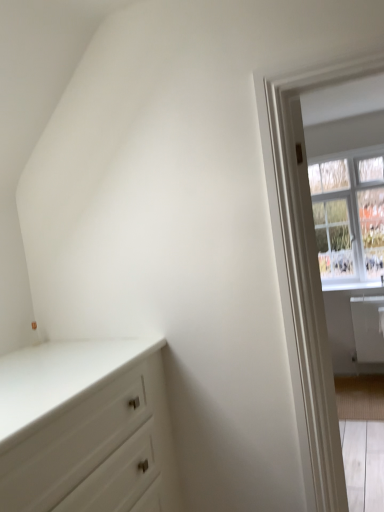
Question: Does white wooden door at right appear on the right side of white glossy chest of drawers at lower left?

Choices:
 (A) no
 (B) yes

Answer: (B)

Question: From the image's perspective, does white wooden door at right appear lower than white glossy chest of drawers at lower left?

Choices:
 (A) yes
 (B) no

Answer: (B)

Question: Are white wooden door at right and white glossy chest of drawers at lower left located far from each other?

Choices:
 (A) no
 (B) yes

Answer: (A)

Question: Considering the relative sizes of white wooden door at right and white glossy chest of drawers at lower left in the image provided, is white wooden door at right wider than white glossy chest of drawers at lower left?

Choices:
 (A) yes
 (B) no

Answer: (B)

Question: Does white wooden door at right have a larger size compared to white glossy chest of drawers at lower left?

Choices:
 (A) no
 (B) yes

Answer: (A)

Question: In terms of height, does white glossy chest of drawers at lower left look taller or shorter compared to clear glass window at upper right?

Choices:
 (A) short
 (B) tall

Answer: (A)

Question: Do you think white glossy chest of drawers at lower left is within clear glass window at upper right, or outside of it?

Choices:
 (A) inside
 (B) outside

Answer: (B)

Question: Does point (4, 357) appear closer or farther from the camera than point (344, 187)?

Choices:
 (A) closer
 (B) farther

Answer: (A)

Question: Is white glossy chest of drawers at lower left wider or thinner than clear glass window at upper right?

Choices:
 (A) thin
 (B) wide

Answer: (B)

Question: From the image's perspective, is white wooden door at right located above or below white glossy window sill at right?

Choices:
 (A) above
 (B) below

Answer: (B)

Question: Choose the correct answer: Is white wooden door at right inside white glossy window sill at right or outside it?

Choices:
 (A) inside
 (B) outside

Answer: (B)

Question: Considering their positions, is white wooden door at right located in front of or behind white glossy window sill at right?

Choices:
 (A) front
 (B) behind

Answer: (A)

Question: Based on their sizes in the image, would you say white wooden door at right is bigger or smaller than white glossy window sill at right?

Choices:
 (A) small
 (B) big

Answer: (B)

Question: Is white glossy chest of drawers at lower left in front of or behind white glossy window sill at right in the image?

Choices:
 (A) front
 (B) behind

Answer: (A)

Question: Do you think white glossy chest of drawers at lower left is within white glossy window sill at right, or outside of it?

Choices:
 (A) inside
 (B) outside

Answer: (B)